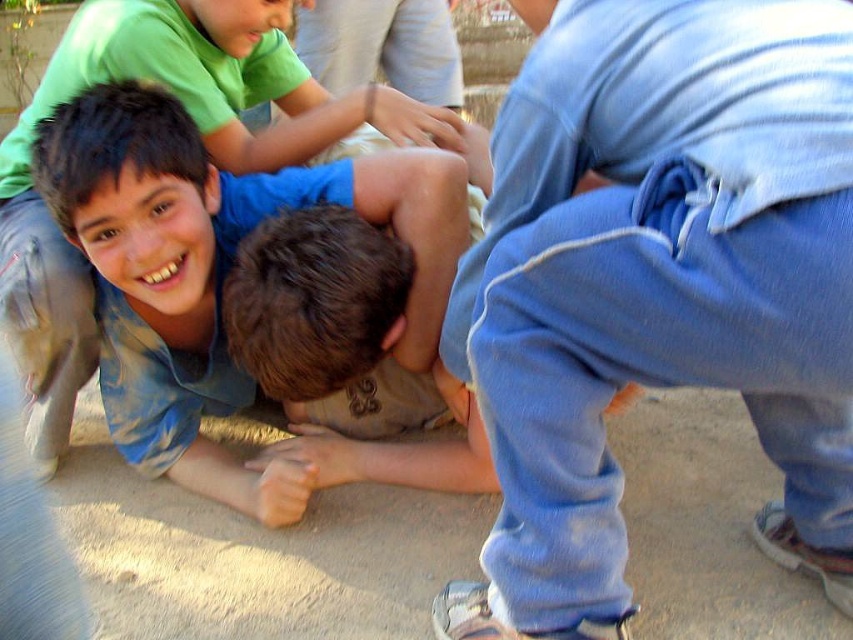
Does blue sweatpants at lower right have a smaller size compared to blue tie-dye shirt at center?

Yes.

Which is behind, point (814, 468) or point (57, 317)?

Point (57, 317)

Is point (792, 508) closer to camera compared to point (154, 16)?

Yes, it is.

I want to click on blue sweatpants at lower right, so click(x=659, y=280).